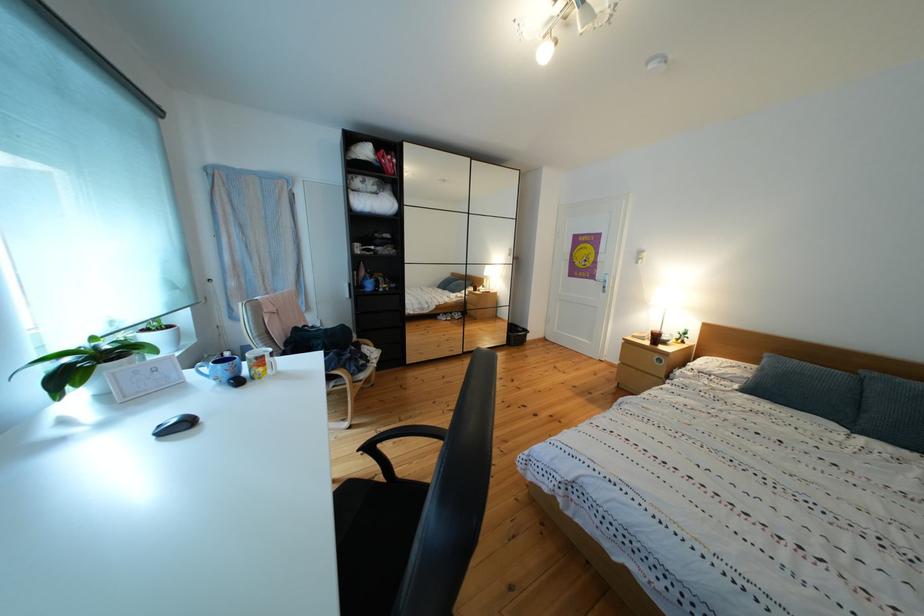
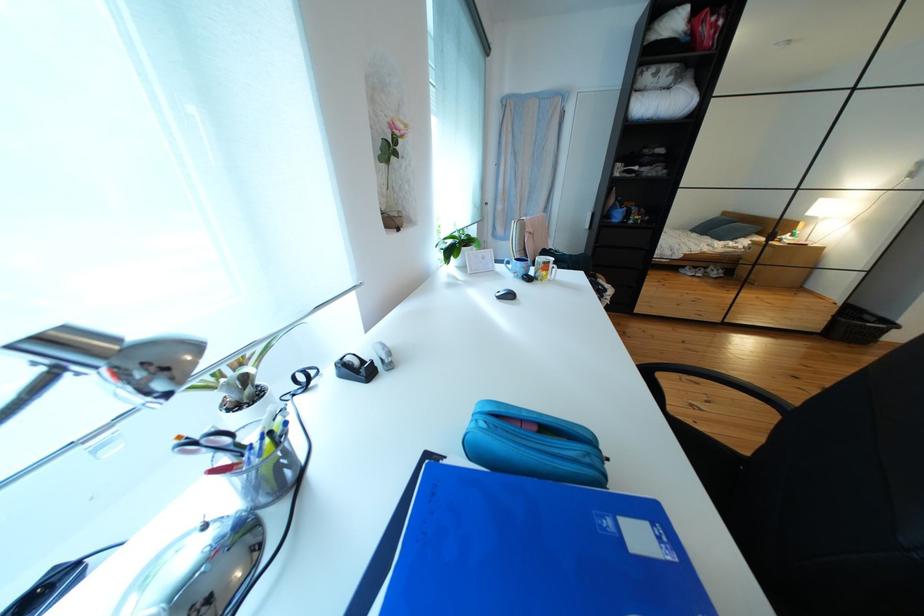
Consider the image. The images are taken continuously from a first-person perspective. In which direction is your viewpoint rotating?

The camera rotated toward left-down.